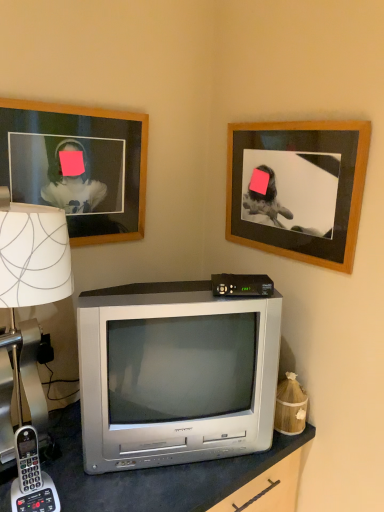
Question: From a real-world perspective, is white paper lampshade at left beneath silver metallic television at center?

Choices:
 (A) yes
 (B) no

Answer: (B)

Question: From the image's perspective, does white paper lampshade at left appear higher than silver metallic television at center?

Choices:
 (A) no
 (B) yes

Answer: (B)

Question: Is white paper lampshade at left positioned far away from silver metallic television at center?

Choices:
 (A) yes
 (B) no

Answer: (B)

Question: Is white paper lampshade at left not inside silver metallic television at center?

Choices:
 (A) yes
 (B) no

Answer: (A)

Question: From the image's perspective, is white paper lampshade at left under silver metallic television at center?

Choices:
 (A) yes
 (B) no

Answer: (B)

Question: Considering the positions of point (129, 321) and point (238, 238), is point (129, 321) closer or farther from the camera than point (238, 238)?

Choices:
 (A) farther
 (B) closer

Answer: (B)

Question: From the image's perspective, is silver metallic television at center positioned above or below wooden frame at upper right, placed as the second picture frame when sorted from left to right?

Choices:
 (A) below
 (B) above

Answer: (A)

Question: Looking at their shapes, would you say silver metallic television at center is wider or thinner than wooden frame at upper right, the 1th picture frame positioned from the right?

Choices:
 (A) wide
 (B) thin

Answer: (A)

Question: Is silver metallic television at center taller or shorter than wooden frame at upper right, the 1th picture frame positioned from the right?

Choices:
 (A) short
 (B) tall

Answer: (B)

Question: Based on their sizes in the image, would you say gray plastic phone at lower left is bigger or smaller than wooden framed photo at upper left, arranged as the 1th picture frame when viewed from the left?

Choices:
 (A) big
 (B) small

Answer: (B)

Question: In the image, is gray plastic phone at lower left on the left side or the right side of wooden framed photo at upper left, which is the second picture frame in right-to-left order?

Choices:
 (A) right
 (B) left

Answer: (B)

Question: From a real-world perspective, is gray plastic phone at lower left positioned above or below wooden framed photo at upper left, which is the second picture frame in right-to-left order?

Choices:
 (A) below
 (B) above

Answer: (A)

Question: Is gray plastic phone at lower left taller or shorter than wooden framed photo at upper left, arranged as the 1th picture frame when viewed from the left?

Choices:
 (A) short
 (B) tall

Answer: (A)

Question: Does point (276, 176) appear closer or farther from the camera than point (6, 193)?

Choices:
 (A) farther
 (B) closer

Answer: (A)

Question: Which is correct: wooden frame at upper right, the 1th picture frame positioned from the right, is inside white paper lampshade at left, or outside of it?

Choices:
 (A) inside
 (B) outside

Answer: (B)